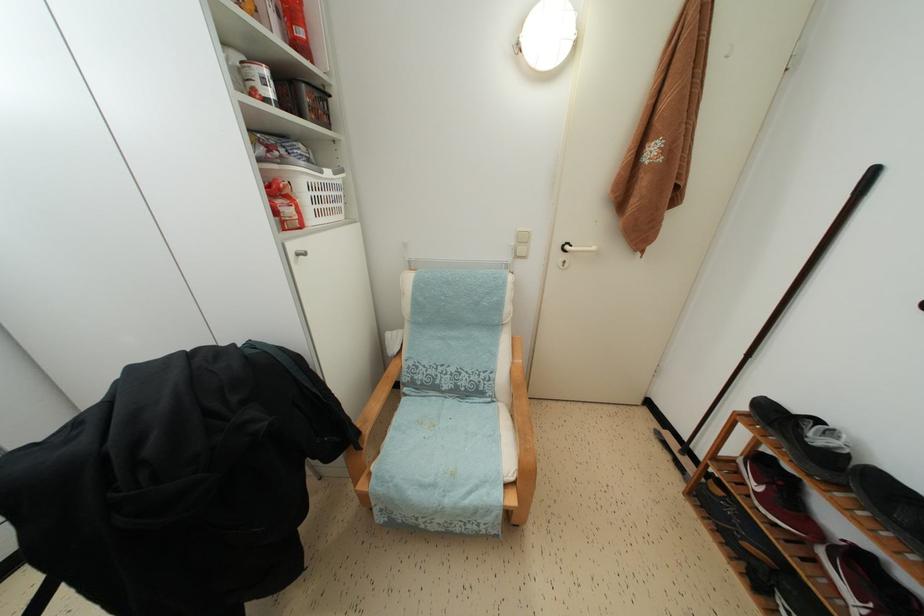
I want to click on white light switch, so click(521, 244).